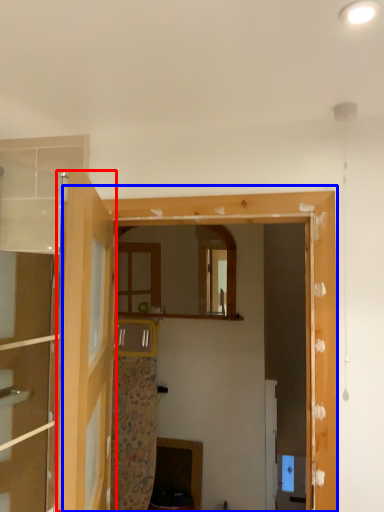
Question: Which point is further to the camera, door (highlighted by a red box) or window frame (highlighted by a blue box)?

Choices:
 (A) door
 (B) window frame

Answer: (B)